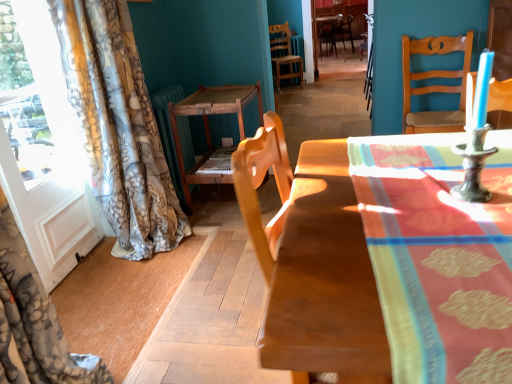
Question: Can you confirm if metallic candle holder at right is taller than wooden chair at center, placed as the 2th chair when sorted from front to back?

Choices:
 (A) no
 (B) yes

Answer: (A)

Question: Would you say metallic candle holder at right is outside wooden chair at center, marked as the 2th chair in a top-to-bottom arrangement?

Choices:
 (A) yes
 (B) no

Answer: (A)

Question: Is metallic candle holder at right further to the viewer compared to wooden chair at center, the 2th chair from the back?

Choices:
 (A) yes
 (B) no

Answer: (B)

Question: Is metallic candle holder at right at the right side of wooden chair at center, which appears as the 3th chair when viewed from the right?

Choices:
 (A) no
 (B) yes

Answer: (A)

Question: Is the position of metallic candle holder at right less distant than that of wooden chair at center, placed as the 2th chair when sorted from front to back?

Choices:
 (A) yes
 (B) no

Answer: (A)

Question: Does metallic candle holder at right have a lesser height compared to wooden chair at center, which appears as the 3th chair when viewed from the right?

Choices:
 (A) no
 (B) yes

Answer: (B)

Question: From the image's perspective, is wooden chair at right, which is the 1th chair from front to back, located above floral-patterned fabric at left?

Choices:
 (A) yes
 (B) no

Answer: (A)

Question: Can you confirm if wooden chair at right, which appears as the 2th chair when viewed from the left, is bigger than floral-patterned fabric at left?

Choices:
 (A) no
 (B) yes

Answer: (A)

Question: From a real-world perspective, is wooden chair at right, the first chair from the bottom, physically below floral-patterned fabric at left?

Choices:
 (A) yes
 (B) no

Answer: (A)

Question: Is wooden chair at right, which is the 1th chair from front to back, looking in the opposite direction of floral-patterned fabric at left?

Choices:
 (A) yes
 (B) no

Answer: (B)

Question: Does wooden chair at right, which is the 1th chair from front to back, have a greater height compared to floral-patterned fabric at left?

Choices:
 (A) no
 (B) yes

Answer: (A)

Question: Is wooden chair at right, the first chair from the bottom, thinner than floral-patterned fabric at left?

Choices:
 (A) no
 (B) yes

Answer: (B)

Question: Is wooden chair at center, the 1th chair in the left-to-right sequence, at the left side of wooden chair at center, which is the first chair from top to bottom?

Choices:
 (A) yes
 (B) no

Answer: (A)